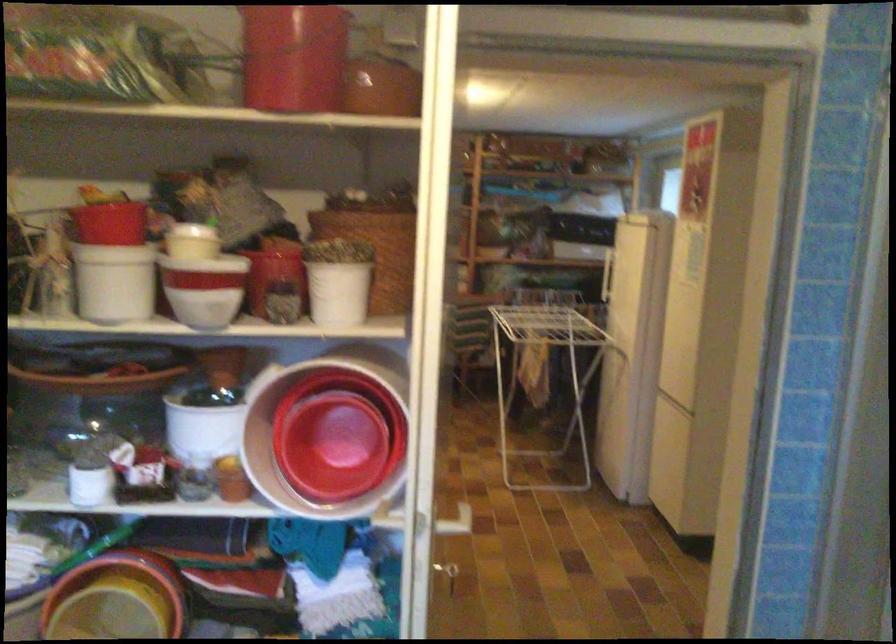
Which object does [294,57] point to?

It corresponds to the red plastic bucket in the image.